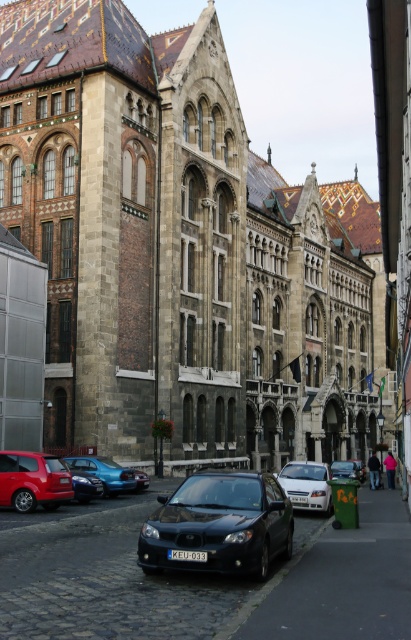
Is white metallic sedan at center further to the viewer compared to metallic blue sedan at center?

No.

Does white metallic sedan at center appear on the left side of metallic blue sedan at center?

Incorrect, white metallic sedan at center is not on the left side of metallic blue sedan at center.

At what (x,y) coordinates should I click in order to perform the action: click on white metallic sedan at center. Please return your answer as a coordinate pair (x, y). The image size is (411, 640). Looking at the image, I should click on (307, 484).

Where is `white metallic sedan at center`? Image resolution: width=411 pixels, height=640 pixels. white metallic sedan at center is located at coordinates (307, 484).

Can you confirm if shiny black sedan at center is shorter than matte red car at lower left?

No.

Find the location of a particular element. Image resolution: width=411 pixels, height=640 pixels. shiny black sedan at center is located at coordinates (219, 525).

Locate an element on the screen. Image resolution: width=411 pixels, height=640 pixels. shiny black sedan at center is located at coordinates (219, 525).

What do you see at coordinates (182, 250) in the screenshot?
I see `stone church at center` at bounding box center [182, 250].

Does point (67, 10) come closer to viewer compared to point (7, 486)?

No, (67, 10) is further to viewer.

Is point (59, 188) less distant than point (50, 496)?

No.

Where is `stone church at center`? stone church at center is located at coordinates (182, 250).